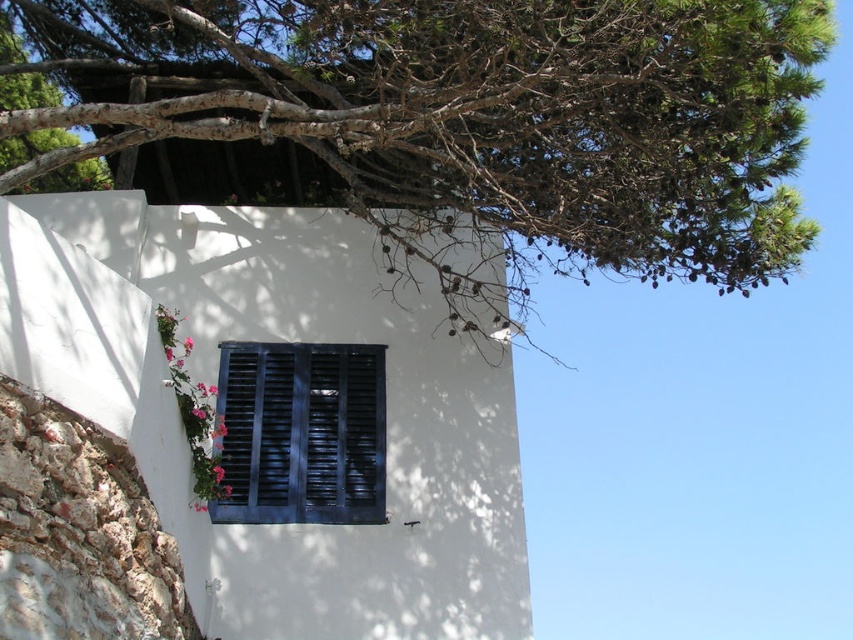
From the picture: Is green leafy tree at upper center shorter than dark wood shutters at center?

In fact, green leafy tree at upper center may be taller than dark wood shutters at center.

Is green leafy tree at upper center to the left of dark wood shutters at center from the viewer's perspective?

Incorrect, green leafy tree at upper center is not on the left side of dark wood shutters at center.

This screenshot has width=853, height=640. I want to click on green leafy tree at upper center, so tap(482, 122).

The width and height of the screenshot is (853, 640). Find the location of `green leafy tree at upper center`. green leafy tree at upper center is located at coordinates (482, 122).